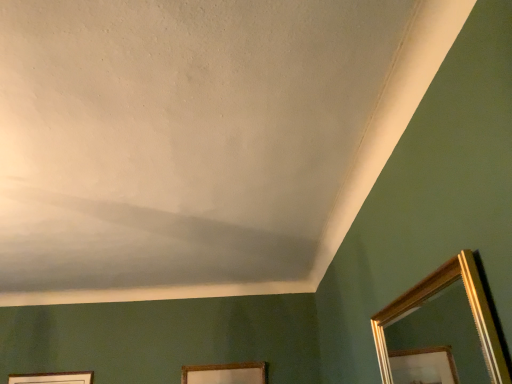
What is the approximate width of gold wooden picture frame at lower center?

2.17 inches.

Where is `gold wooden picture frame at lower center`? The width and height of the screenshot is (512, 384). gold wooden picture frame at lower center is located at coordinates (225, 373).

Describe the element at coordinates (225, 373) in the screenshot. The height and width of the screenshot is (384, 512). I see `gold wooden picture frame at lower center` at that location.

What is the approximate height of gold wooden picture frame at lower center?

The height of gold wooden picture frame at lower center is 7.40 inches.

Where is `gold-framed mirror at lower right`? The width and height of the screenshot is (512, 384). gold-framed mirror at lower right is located at coordinates (437, 342).

This screenshot has height=384, width=512. What do you see at coordinates (437, 342) in the screenshot? I see `gold-framed mirror at lower right` at bounding box center [437, 342].

Identify the location of gold wooden picture frame at lower center. The image size is (512, 384). (225, 373).

From the picture: Which is more to the right, gold wooden picture frame at lower center or gold-framed mirror at lower right?

From the viewer's perspective, gold-framed mirror at lower right appears more on the right side.

Considering the positions of objects gold wooden picture frame at lower center and gold-framed mirror at lower right in the image provided, who is in front, gold wooden picture frame at lower center or gold-framed mirror at lower right?

gold-framed mirror at lower right.

Does point (260, 376) lie in front of point (394, 380)?

Yes.

From the image's perspective, who appears lower, gold wooden picture frame at lower center or gold-framed mirror at lower right?

gold wooden picture frame at lower center, from the image's perspective.

From a real-world perspective, is gold wooden picture frame at lower center physically above gold-framed mirror at lower right?

Yes, from a real-world perspective, gold wooden picture frame at lower center is on top of gold-framed mirror at lower right.

Is gold wooden picture frame at lower center wider than gold-framed mirror at lower right?

No.

Considering the sizes of gold wooden picture frame at lower center and gold-framed mirror at lower right in the image, is gold wooden picture frame at lower center taller or shorter than gold-framed mirror at lower right?

Considering their sizes, gold wooden picture frame at lower center has less height than gold-framed mirror at lower right.

Considering the relative sizes of gold wooden picture frame at lower center and gold-framed mirror at lower right in the image provided, is gold wooden picture frame at lower center smaller than gold-framed mirror at lower right?

Correct, gold wooden picture frame at lower center occupies less space than gold-framed mirror at lower right.

Is gold-framed mirror at lower right completely or partially inside gold wooden picture frame at lower center?

No, gold-framed mirror at lower right is not a part of gold wooden picture frame at lower center.

Are gold wooden picture frame at lower center and gold-framed mirror at lower right making contact?

They are not placed beside each other.

Is gold wooden picture frame at lower center oriented away from gold-framed mirror at lower right?

No, gold wooden picture frame at lower center is not facing the opposite direction of gold-framed mirror at lower right.

Can you tell me how much gold wooden picture frame at lower center and gold-framed mirror at lower right differ in facing direction?

89.7 degrees.

In the image, there is a gold wooden picture frame at lower center. Where is `mirror below it (from a real-world perspective)`? Image resolution: width=512 pixels, height=384 pixels. mirror below it (from a real-world perspective) is located at coordinates (437, 342).

Can you confirm if gold-framed mirror at lower right is positioned to the left of gold wooden picture frame at lower center?

No, gold-framed mirror at lower right is not to the left of gold wooden picture frame at lower center.

Relative to gold wooden picture frame at lower center, is gold-framed mirror at lower right in front or behind?

Visually, gold-framed mirror at lower right is located in front of gold wooden picture frame at lower center.

Which is closer to the camera, (411, 366) or (232, 363)?

Clearly, point (411, 366) is closer to the camera than point (232, 363).

From the image's perspective, is gold-framed mirror at lower right on top of gold wooden picture frame at lower center?

Indeed, from the image's perspective, gold-framed mirror at lower right is shown above gold wooden picture frame at lower center.

From a real-world perspective, is gold-framed mirror at lower right physically located above or below gold wooden picture frame at lower center?

From a real-world perspective, gold-framed mirror at lower right is physically below gold wooden picture frame at lower center.

Does gold-framed mirror at lower right have a lesser width compared to gold wooden picture frame at lower center?

In fact, gold-framed mirror at lower right might be wider than gold wooden picture frame at lower center.

Which of these two, gold-framed mirror at lower right or gold wooden picture frame at lower center, stands taller?

gold-framed mirror at lower right is taller.

Consider the image. Who is bigger, gold-framed mirror at lower right or gold wooden picture frame at lower center?

Bigger between the two is gold-framed mirror at lower right.

Is gold wooden picture frame at lower center surrounded by gold-framed mirror at lower right?

No, gold wooden picture frame at lower center is not a part of gold-framed mirror at lower right.

Is gold-framed mirror at lower right not near gold wooden picture frame at lower center?

Absolutely, gold-framed mirror at lower right is distant from gold wooden picture frame at lower center.

Is gold-framed mirror at lower right oriented away from gold wooden picture frame at lower center?

No, gold-framed mirror at lower right's orientation is not away from gold wooden picture frame at lower center.

How far apart are gold-framed mirror at lower right and gold wooden picture frame at lower center?

They are 1.53 meters apart.

The width and height of the screenshot is (512, 384). I want to click on picture frame that appears behind the gold-framed mirror at lower right, so click(225, 373).

The height and width of the screenshot is (384, 512). I want to click on picture frame behind the gold-framed mirror at lower right, so click(225, 373).

At what (x,y) coordinates should I click in order to perform the action: click on picture frame below the gold-framed mirror at lower right (from the image's perspective). Please return your answer as a coordinate pair (x, y). The image size is (512, 384). Looking at the image, I should click on (225, 373).